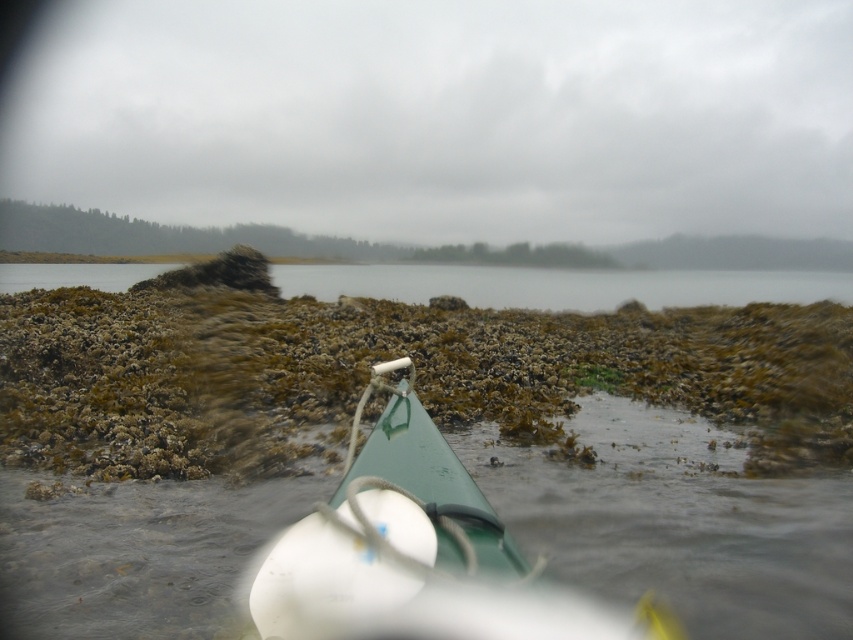
Which is more to the left, green rubber boat at center or brown algae-covered rocks at lower center?

brown algae-covered rocks at lower center is more to the left.

Does green rubber boat at center appear under brown algae-covered rocks at lower center?

Yes.

Between point (776, 525) and point (502, 301), which one is positioned behind?

The point (502, 301) is behind.

At what (x,y) coordinates should I click in order to perform the action: click on green rubber boat at center. Please return your answer as a coordinate pair (x, y). The height and width of the screenshot is (640, 853). Looking at the image, I should click on (674, 516).

Can you confirm if green rubber boat at center is shorter than green matte boat at center?

No, green rubber boat at center is not shorter than green matte boat at center.

Is green rubber boat at center bigger than green matte boat at center?

Yes.

What do you see at coordinates (674, 516) in the screenshot? The image size is (853, 640). I see `green rubber boat at center` at bounding box center [674, 516].

At what (x,y) coordinates should I click in order to perform the action: click on green rubber boat at center. Please return your answer as a coordinate pair (x, y). This screenshot has width=853, height=640. Looking at the image, I should click on (674, 516).

Image resolution: width=853 pixels, height=640 pixels. What do you see at coordinates (418, 552) in the screenshot?
I see `green matte boat at center` at bounding box center [418, 552].

Is point (477, 506) farther from camera compared to point (717, 304)?

That is False.

The width and height of the screenshot is (853, 640). Find the location of `green matte boat at center`. green matte boat at center is located at coordinates (418, 552).